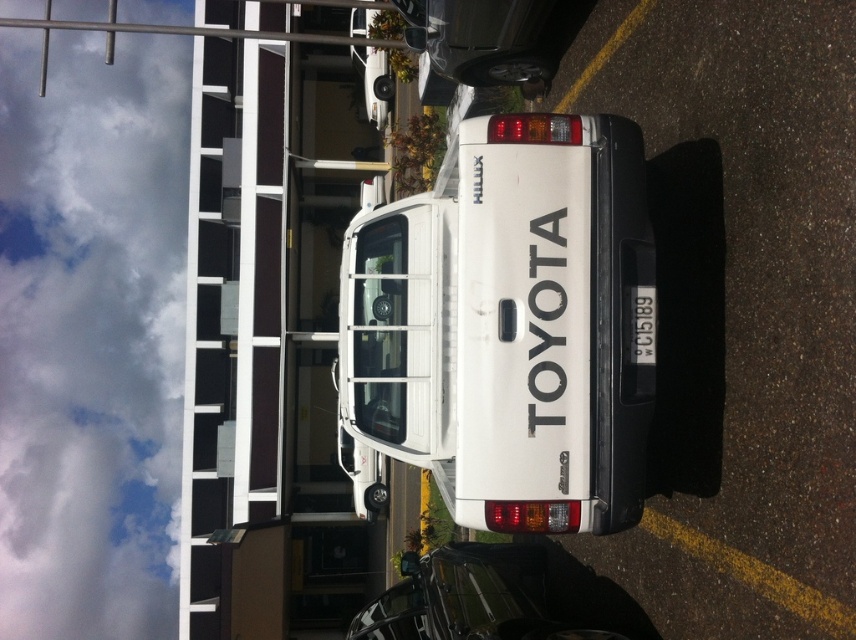
Does glossy black car at lower right have a greater height compared to white plastic license plate at center?

No.

Is glossy black car at lower right further to camera compared to white plastic license plate at center?

Yes, glossy black car at lower right is behind white plastic license plate at center.

At what (x,y) coordinates should I click in order to perform the action: click on glossy black car at lower right. Please return your answer as a coordinate pair (x, y). Image resolution: width=856 pixels, height=640 pixels. Looking at the image, I should click on (468, 596).

Is white matte truck at center below white plastic license plate at center?

Yes, white matte truck at center is below white plastic license plate at center.

The image size is (856, 640). What are the coordinates of `white matte truck at center` in the screenshot? It's located at (508, 324).

Who is more forward, [467,173] or [642,308]?

Point [467,173] is more forward.

This screenshot has width=856, height=640. I want to click on white matte truck at center, so click(x=508, y=324).

Who is taller, white matte truck at center or glossy black car at lower right?

Standing taller between the two is white matte truck at center.

Can you confirm if white matte truck at center is positioned below glossy black car at lower right?

Actually, white matte truck at center is above glossy black car at lower right.

Does point (563, 364) come farther from viewer compared to point (354, 625)?

No, (563, 364) is in front of (354, 625).

The image size is (856, 640). Find the location of `white matte truck at center`. white matte truck at center is located at coordinates (508, 324).